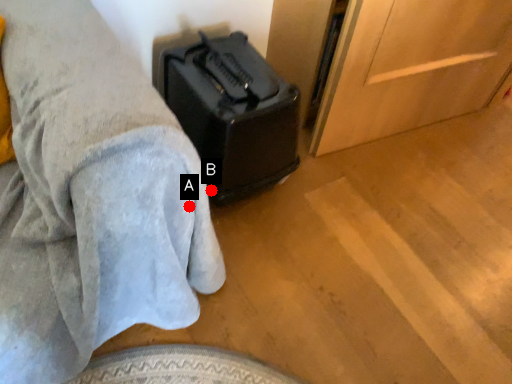
Question: Two points are circled on the image, labeled by A and B beside each circle. Which point is farther from the camera taking this photo?

Choices:
 (A) A is further
 (B) B is further

Answer: (B)